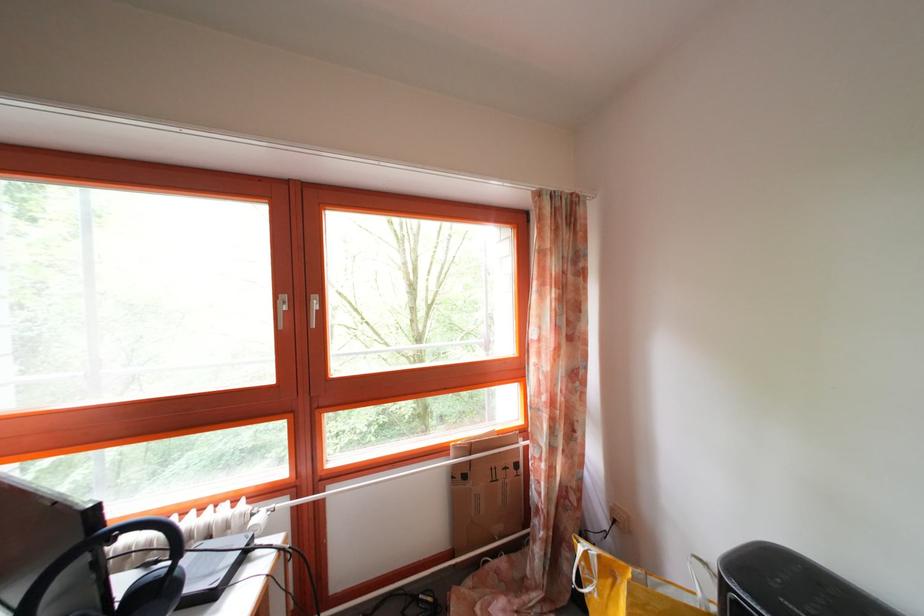
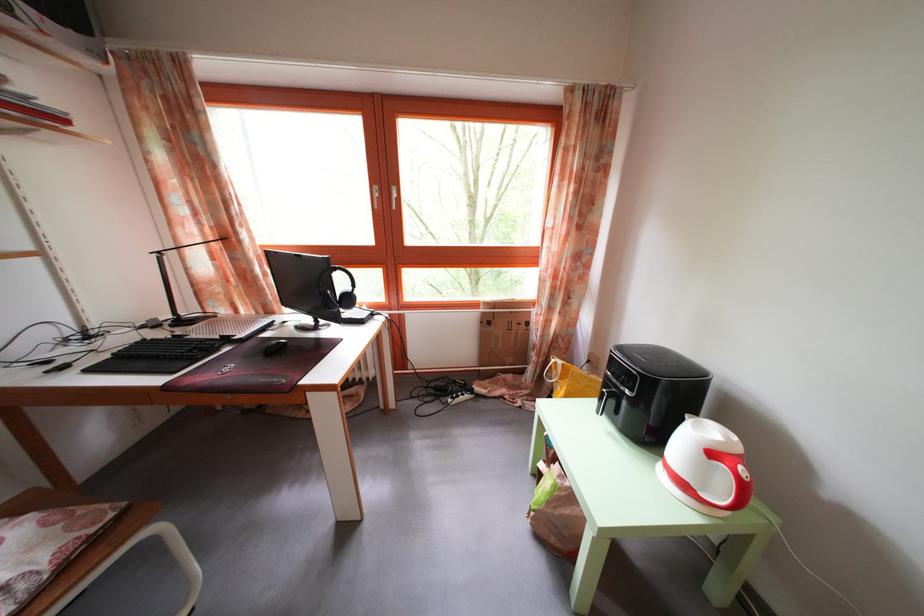
Question: The first image is from the beginning of the video and the second image is from the end. How did the camera likely rotate when shooting the video?

Choices:
 (A) Left
 (B) Right
 (C) Up
 (D) Down

Answer: (D)